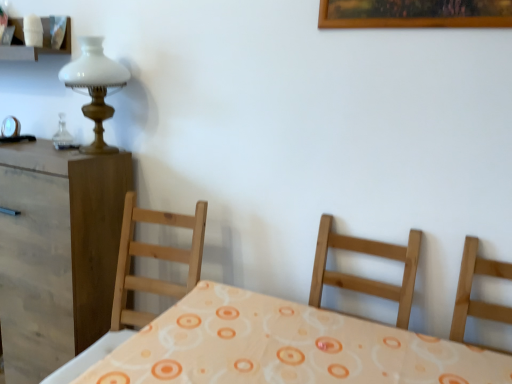
Where is `white glass lamp at upper left`? The width and height of the screenshot is (512, 384). white glass lamp at upper left is located at coordinates (95, 87).

In order to face brown wood nightstand at left, should I rotate leftwards or rightwards?

To face it directly, rotate left by 26.352 degrees.

What is the approximate height of white matte shelf at upper left?

It is 22.45 centimeters.

Image resolution: width=512 pixels, height=384 pixels. In order to click on white glass lamp at upper left in this screenshot , I will do `click(95, 87)`.

Who is shorter, light wood chair at right or brown wood nightstand at left?

Standing shorter between the two is light wood chair at right.

Does light wood chair at right have a smaller size compared to brown wood nightstand at left?

Yes.

From the image's perspective, is light wood chair at right above or below brown wood nightstand at left?

Based on their image positions, light wood chair at right is located beneath brown wood nightstand at left.

Is light wood chair at right looking in the opposite direction of brown wood nightstand at left?

No, brown wood nightstand at left is not at the back of light wood chair at right.

Can you confirm if white glass lamp at upper left is wider than white matte shelf at upper left?

Indeed, white glass lamp at upper left has a greater width compared to white matte shelf at upper left.

Considering the positions of point (101, 57) and point (20, 44), is point (101, 57) closer or farther from the camera than point (20, 44)?

Point (101, 57) is closer to the camera than point (20, 44).

How different are the orientations of white glass lamp at upper left and white matte shelf at upper left in degrees?

white glass lamp at upper left and white matte shelf at upper left are facing 1.43 degrees away from each other.

Which object is more forward, white glass lamp at upper left or white matte shelf at upper left?

white glass lamp at upper left.

Could white matte shelf at upper left be considered to be inside light wood chair at right?

No, white matte shelf at upper left is not a part of light wood chair at right.

Considering the sizes of objects light wood chair at right and white matte shelf at upper left in the image provided, who is wider, light wood chair at right or white matte shelf at upper left?

light wood chair at right is wider.

Is light wood chair at right bigger or smaller than white matte shelf at upper left?

light wood chair at right is bigger than white matte shelf at upper left.

Does light wood chair at right have a lesser height compared to white matte shelf at upper left?

No, light wood chair at right is not shorter than white matte shelf at upper left.

Between white glass lamp at upper left and brown wood nightstand at left, which one has less height?

white glass lamp at upper left.

Can you confirm if white glass lamp at upper left is bigger than brown wood nightstand at left?

Incorrect, white glass lamp at upper left is not larger than brown wood nightstand at left.

In order to click on nightstand located underneath the white glass lamp at upper left (from a real-world perspective) in this screenshot , I will do pos(57,252).

Considering the positions of points (81, 63) and (108, 268), is point (81, 63) closer to camera compared to point (108, 268)?

Yes, it is in front of point (108, 268).

Could white glass lamp at upper left be considered to be inside brown wood nightstand at left?

Definitely not — white glass lamp at upper left is not inside brown wood nightstand at left.

Is point (3, 276) less distant than point (90, 146)?

That is True.

What's the angular difference between brown wood nightstand at left and white glass lamp at upper left's facing directions?

The angular difference between brown wood nightstand at left and white glass lamp at upper left is 0.0277 degrees.

Between light wood chair at right and white glass lamp at upper left, which one appears on the right side from the viewer's perspective?

From the viewer's perspective, light wood chair at right appears more on the right side.

Considering the sizes of objects light wood chair at right and white glass lamp at upper left in the image provided, who is shorter, light wood chair at right or white glass lamp at upper left?

Standing shorter between the two is white glass lamp at upper left.

Can you confirm if light wood chair at right is smaller than white glass lamp at upper left?

Actually, light wood chair at right might be larger than white glass lamp at upper left.

Measure the distance between light wood chair at right and white glass lamp at upper left.

light wood chair at right and white glass lamp at upper left are 1.51 meters apart from each other.

In terms of width, does white matte shelf at upper left look wider or thinner when compared to brown wood nightstand at left?

Clearly, white matte shelf at upper left has less width compared to brown wood nightstand at left.

Is white matte shelf at upper left not close to brown wood nightstand at left?

No.

From the image's perspective, between white matte shelf at upper left and brown wood nightstand at left, which one is located above?

white matte shelf at upper left.

Is point (63, 47) positioned in front of point (22, 175)?

No, (63, 47) is further to viewer.

Find the location of a particular element. The image size is (512, 384). chair lying in front of the brown wood nightstand at left is located at coordinates (471, 287).

Find the location of `table lamp on the right of white matte shelf at upper left`. table lamp on the right of white matte shelf at upper left is located at coordinates (95, 87).

From the image, which object appears to be farther from light wood chair at right, white glass lamp at upper left or brown wood nightstand at left?

white glass lamp at upper left is further to light wood chair at right.

From the image, which object appears to be farther from brown wood nightstand at left, white glass lamp at upper left or light wood chair at right?

Among the two, light wood chair at right is located further to brown wood nightstand at left.

From the image, which object appears to be nearer to white matte shelf at upper left, brown wood nightstand at left or white glass lamp at upper left?

Among the two, white glass lamp at upper left is located nearer to white matte shelf at upper left.

When comparing their distances from brown wood nightstand at left, does white glass lamp at upper left or white matte shelf at upper left seem further?

white matte shelf at upper left is positioned further to the anchor brown wood nightstand at left.

From the image, which object appears to be nearer to white glass lamp at upper left, light wood chair at right or brown wood nightstand at left?

Among the two, brown wood nightstand at left is located nearer to white glass lamp at upper left.

Which object lies further to the anchor point brown wood nightstand at left, white matte shelf at upper left or white glass lamp at upper left?

Based on the image, white matte shelf at upper left appears to be further to brown wood nightstand at left.

From the image, which object appears to be nearer to brown wood nightstand at left, light wood chair at right or white glass lamp at upper left?

Based on the image, white glass lamp at upper left appears to be nearer to brown wood nightstand at left.

From the image, which object appears to be farther from white glass lamp at upper left, brown wood nightstand at left or light wood chair at right?

light wood chair at right.

Identify the location of table lamp between white matte shelf at upper left and brown wood nightstand at left vertically. (95, 87).

Locate an element on the screen. nightstand situated between white matte shelf at upper left and light wood chair at right from left to right is located at coordinates (57, 252).

What are the coordinates of `table lamp between white matte shelf at upper left and light wood chair at right in the horizontal direction` in the screenshot? It's located at (95, 87).

The image size is (512, 384). Identify the location of table lamp between brown wood nightstand at left and light wood chair at right. (95, 87).